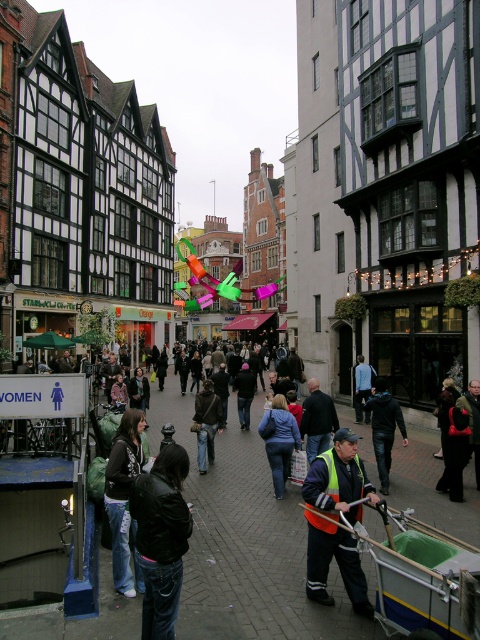
Image resolution: width=480 pixels, height=640 pixels. I want to click on reflective orange vest at center, so click(337, 480).

This screenshot has height=640, width=480. What do you see at coordinates (337, 480) in the screenshot?
I see `reflective orange vest at center` at bounding box center [337, 480].

Where is `reflective orange vest at center`? reflective orange vest at center is located at coordinates (337, 480).

This screenshot has height=640, width=480. In order to click on reflective orange vest at center in this screenshot , I will do `click(337, 480)`.

Does black leather jacket at lower left have a larger size compared to reflective orange vest at center?

No.

Between point (162, 621) and point (310, 490), which one is positioned in front?

Positioned in front is point (162, 621).

Who is more forward, (141, 484) or (356, 508)?

Point (141, 484) is in front.

You are a GUI agent. You are given a task and a screenshot of the screen. Output one action in this format:
    pyautogui.click(x=<x>, y=<y>)
    Task: Click on the black leather jacket at lower left
    The image size is (480, 640).
    Given the screenshot: What is the action you would take?
    pyautogui.click(x=162, y=538)

Can you confirm if dark blue leather jacket at center is positioned to the left of blue fabric jacket at center?

Indeed, dark blue leather jacket at center is positioned on the left side of blue fabric jacket at center.

Between dark blue leather jacket at center and blue fabric jacket at center, which one is positioned lower?

Positioned lower is dark blue leather jacket at center.

What do you see at coordinates (384, 428) in the screenshot? The width and height of the screenshot is (480, 640). I see `dark blue leather jacket at center` at bounding box center [384, 428].

At what (x,y) coordinates should I click in order to perform the action: click on dark blue leather jacket at center. Please return your answer as a coordinate pair (x, y). Looking at the image, I should click on (384, 428).